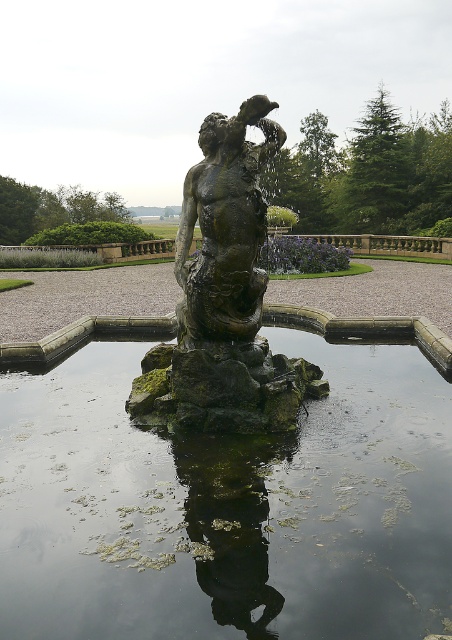
You are standing in the garden looking at the bronze mermaid statue. There are two points marked in the image. The first point is at coordinate point (381, 486) and the second is at point (208, 216). If you were to walk towards both points from your current position, which point would you reach first?

Point (381, 486) is closer to the camera than point (208, 216), so you would reach point (381, 486) first.

You are a gardener who needs to place a new decorative fountain in the garden. The fountain requires a space that is at least 5 inches away from any existing statues. Given the current placement of the green mossy statue at center and the bronze statue at center, can you safely install the fountain between them?

The distance between the green mossy statue at center and the bronze statue at center is 4.09 inches. Since the required minimum distance for the fountain is 5 inches, the space between them is insufficient. Choose another location for the fountain.